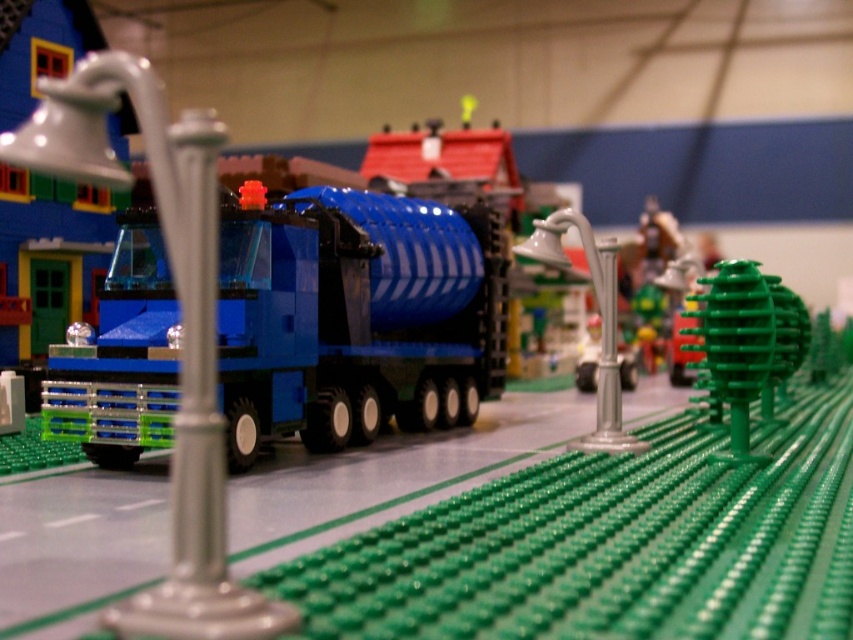
You are a Lego modeler working on a miniature scene. You need to place a new Lego piece that is 5 inches long between the green matte tree at center right and the metallic silver faucet at center. Is there enough space between them to fit this piece?

The distance between the green matte tree at center right and the metallic silver faucet at center is 7.43 inches. Since the new Lego piece is 5 inches long, there is enough space to fit it between them.

You are holding a camera and want to take a photo of the matte blue plastic truck at center. If your camera can focus on objects up to 4 feet away, will it be able to capture the truck clearly?

The matte blue plastic truck at center is 3.84 feet away from the camera, which is within the 4 feet focus range, so yes, the camera can capture it clearly.

You are a Lego builder looking at the diorama. You notice the green matte tree at center right and the metallic silver faucet at center. Which object is located below the other?

The green matte tree at center right is positioned under the metallic silver faucet at center.